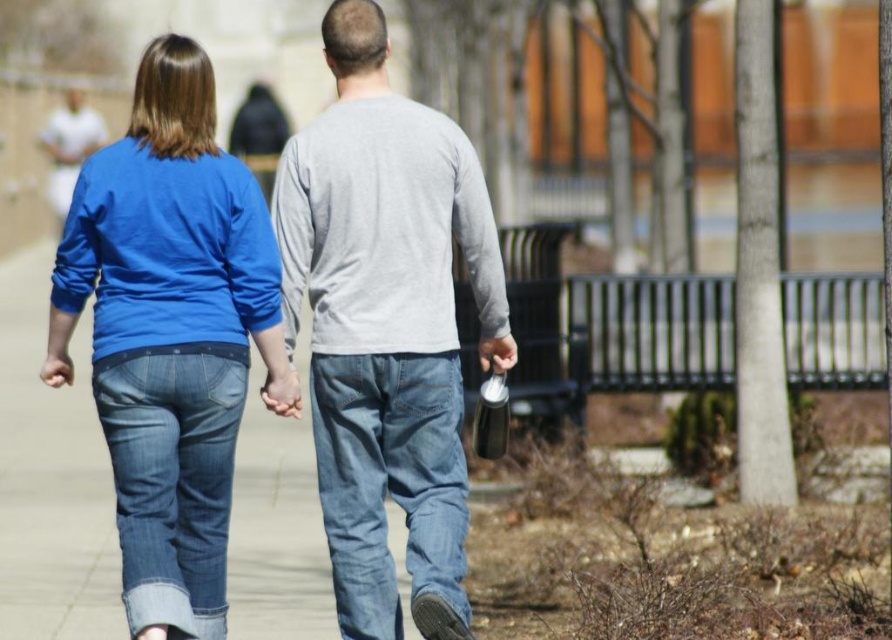
You are a photographer trying to capture a closeup of the matte blue jeans at left and the denim jeans at lower left. Which pair of jeans will appear larger in your photo?

The matte blue jeans at left will appear larger in the photo because it is closer to the viewer than the denim jeans at lower left.